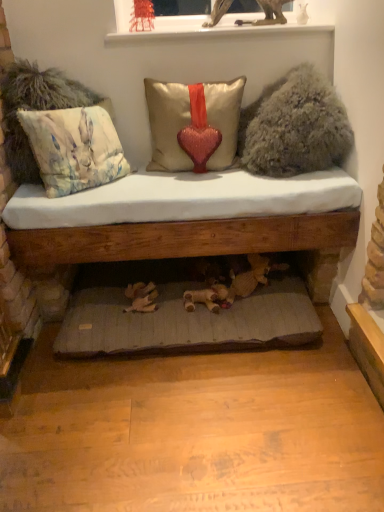
Where is `satin/velvet pillow with heart at center, which is the first pillow in right-to-left order`? The height and width of the screenshot is (512, 384). satin/velvet pillow with heart at center, which is the first pillow in right-to-left order is located at coordinates (193, 124).

This screenshot has height=512, width=384. What do you see at coordinates (193, 124) in the screenshot?
I see `satin/velvet pillow with heart at center, which appears as the second pillow when viewed from the left` at bounding box center [193, 124].

Where is `gray fabric cushion at lower center`? gray fabric cushion at lower center is located at coordinates (195, 432).

Measure the distance between pastel floral fabric cushion at left, arranged as the 1th pillow when viewed from the left, and camera.

They are 5.20 feet apart.

The width and height of the screenshot is (384, 512). Describe the element at coordinates (198, 242) in the screenshot. I see `wooden cushioned bench at center` at that location.

Find the location of a particular element. The image size is (384, 512). fuzzy beige pillow at upper right is located at coordinates (295, 126).

What do you see at coordinates (295, 126) in the screenshot? I see `fuzzy beige pillow at upper right` at bounding box center [295, 126].

The image size is (384, 512). In order to click on satin/velvet pillow with heart at center, which appears as the second pillow when viewed from the left in this screenshot , I will do `click(193, 124)`.

Are wooden bed frame at lower center and fuzzy beige pillow at upper right located far from each other?

No, there isn't a large distance between wooden bed frame at lower center and fuzzy beige pillow at upper right.

Is wooden bed frame at lower center at the right side of fuzzy beige pillow at upper right?

Answer: No, wooden bed frame at lower center is not to the right of fuzzy beige pillow at upper right.

From the image's perspective, is wooden bed frame at lower center located above or below fuzzy beige pillow at upper right?

Clearly, from the image's perspective, wooden bed frame at lower center is below fuzzy beige pillow at upper right.

Considering the sizes of objects wooden bed frame at lower center and fuzzy beige pillow at upper right in the image provided, who is taller, wooden bed frame at lower center or fuzzy beige pillow at upper right?

With more height is fuzzy beige pillow at upper right.

Looking at this image, is gray fabric cushion at lower center oriented away from wooden cushioned bench at center?

No, gray fabric cushion at lower center is not facing the opposite direction of wooden cushioned bench at center.

From the image's perspective, would you say gray fabric cushion at lower center is shown under wooden cushioned bench at center?

Yes.

Is gray fabric cushion at lower center to the right of wooden cushioned bench at center from the viewer's perspective?

No, gray fabric cushion at lower center is not to the right of wooden cushioned bench at center.

How different are the orientations of gray fabric cushion at lower center and wooden cushioned bench at center in degrees?

They differ by 90 degrees in their facing directions.

Is pastel floral fabric cushion at left, arranged as the 1th pillow when viewed from the left, at the left side of satin/velvet pillow with heart at center, which appears as the second pillow when viewed from the left?

Correct, you'll find pastel floral fabric cushion at left, arranged as the 1th pillow when viewed from the left, to the left of satin/velvet pillow with heart at center, which appears as the second pillow when viewed from the left.

Is pastel floral fabric cushion at left, arranged as the 1th pillow when viewed from the left, wider or thinner than satin/velvet pillow with heart at center, which is the first pillow in right-to-left order?

In the image, pastel floral fabric cushion at left, arranged as the 1th pillow when viewed from the left, appears to be more narrow than satin/velvet pillow with heart at center, which is the first pillow in right-to-left order.

In the scene shown: Is pastel floral fabric cushion at left, acting as the second pillow starting from the right, beside satin/velvet pillow with heart at center, which is the first pillow in right-to-left order?

There is a gap between pastel floral fabric cushion at left, acting as the second pillow starting from the right, and satin/velvet pillow with heart at center, which is the first pillow in right-to-left order.

Considering the relative sizes of white glossy window sill at upper center and fuzzy beige pillow at upper right in the image provided, is white glossy window sill at upper center smaller than fuzzy beige pillow at upper right?

Correct, white glossy window sill at upper center occupies less space than fuzzy beige pillow at upper right.

Which is behind, white glossy window sill at upper center or fuzzy beige pillow at upper right?

white glossy window sill at upper center is behind.

From a real-world perspective, does white glossy window sill at upper center sit lower than fuzzy beige pillow at upper right?

No, from a real-world perspective, white glossy window sill at upper center is not below fuzzy beige pillow at upper right.

Considering the relative sizes of white glossy window sill at upper center and fuzzy beige pillow at upper right in the image provided, is white glossy window sill at upper center taller than fuzzy beige pillow at upper right?

No.

Considering the sizes of fuzzy beige pillow at upper right and wooden cushioned bench at center in the image, is fuzzy beige pillow at upper right taller or shorter than wooden cushioned bench at center?

In the image, fuzzy beige pillow at upper right appears to be shorter than wooden cushioned bench at center.

Locate an element on the screen. Image resolution: width=384 pixels, height=512 pixels. studio couch behind the fuzzy beige pillow at upper right is located at coordinates (198, 242).

How different are the orientations of gray fabric cushion at lower center and white glossy window sill at upper center in degrees?

There is a 90-degree angle between the facing directions of gray fabric cushion at lower center and white glossy window sill at upper center.

Does gray fabric cushion at lower center have a lesser width compared to white glossy window sill at upper center?

Incorrect, the width of gray fabric cushion at lower center is not less than that of white glossy window sill at upper center.

From a real-world perspective, is gray fabric cushion at lower center above or below white glossy window sill at upper center?

gray fabric cushion at lower center is below white glossy window sill at upper center.

Is there a large distance between gray fabric cushion at lower center and white glossy window sill at upper center?

gray fabric cushion at lower center is positioned a significant distance from white glossy window sill at upper center.

How many degrees apart are the facing directions of fuzzy beige pillow at upper right and pastel floral fabric cushion at left, acting as the second pillow starting from the right?

The angle between the facing direction of fuzzy beige pillow at upper right and the facing direction of pastel floral fabric cushion at left, acting as the second pillow starting from the right, is 44.8 degrees.

Is fuzzy beige pillow at upper right located outside pastel floral fabric cushion at left, arranged as the 1th pillow when viewed from the left?

Indeed, fuzzy beige pillow at upper right is completely outside pastel floral fabric cushion at left, arranged as the 1th pillow when viewed from the left.

Is fuzzy beige pillow at upper right beside pastel floral fabric cushion at left, arranged as the 1th pillow when viewed from the left?

No, fuzzy beige pillow at upper right is not beside pastel floral fabric cushion at left, arranged as the 1th pillow when viewed from the left.

Which is closer to the camera, (260, 112) or (117, 150)?

The point (117, 150) is closer to the camera.

What are the coordinates of `bed frame below the fuzzy beige pillow at upper right (from the image's perspective)` in the screenshot? It's located at (180, 313).

Image resolution: width=384 pixels, height=512 pixels. In order to click on platform located in front of the wooden cushioned bench at center in this screenshot , I will do `click(195, 432)`.

Estimate the real-world distances between objects in this image. Which object is further from white glossy window sill at upper center, pastel floral fabric cushion at left, arranged as the 1th pillow when viewed from the left, or satin/velvet pillow with heart at center, which appears as the second pillow when viewed from the left?

Based on the image, pastel floral fabric cushion at left, arranged as the 1th pillow when viewed from the left, appears to be further to white glossy window sill at upper center.

Estimate the real-world distances between objects in this image. Which object is closer to pastel floral fabric cushion at left, acting as the second pillow starting from the right, gray fabric cushion at lower center or white glossy window sill at upper center?

The object closer to pastel floral fabric cushion at left, acting as the second pillow starting from the right, is white glossy window sill at upper center.

Based on their spatial positions, is pastel floral fabric cushion at left, acting as the second pillow starting from the right, or white glossy window sill at upper center closer to gray fabric cushion at lower center?

Based on the image, pastel floral fabric cushion at left, acting as the second pillow starting from the right, appears to be nearer to gray fabric cushion at lower center.

Based on their spatial positions, is pastel floral fabric cushion at left, acting as the second pillow starting from the right, or wooden cushioned bench at center further from fuzzy beige pillow at upper right?

Based on the image, pastel floral fabric cushion at left, acting as the second pillow starting from the right, appears to be further to fuzzy beige pillow at upper right.

Estimate the real-world distances between objects in this image. Which object is further from wooden bed frame at lower center, gray fabric cushion at lower center or satin/velvet pillow with heart at center, which is the first pillow in right-to-left order?

The object further to wooden bed frame at lower center is satin/velvet pillow with heart at center, which is the first pillow in right-to-left order.

Based on their spatial positions, is pastel floral fabric cushion at left, acting as the second pillow starting from the right, or gray fabric cushion at lower center closer to white glossy window sill at upper center?

pastel floral fabric cushion at left, acting as the second pillow starting from the right, is closer to white glossy window sill at upper center.

When comparing their distances from satin/velvet pillow with heart at center, which is the first pillow in right-to-left order, does pastel floral fabric cushion at left, acting as the second pillow starting from the right, or gray fabric cushion at lower center seem closer?

Based on the image, pastel floral fabric cushion at left, acting as the second pillow starting from the right, appears to be nearer to satin/velvet pillow with heart at center, which is the first pillow in right-to-left order.

Based on their spatial positions, is pastel floral fabric cushion at left, arranged as the 1th pillow when viewed from the left, or wooden bed frame at lower center closer to satin/velvet pillow with heart at center, which is the first pillow in right-to-left order?

The object closer to satin/velvet pillow with heart at center, which is the first pillow in right-to-left order, is pastel floral fabric cushion at left, arranged as the 1th pillow when viewed from the left.

This screenshot has height=512, width=384. Identify the location of studio couch between white glossy window sill at upper center and wooden bed frame at lower center vertically. (198, 242).

Locate an element on the screen. The width and height of the screenshot is (384, 512). studio couch between satin/velvet pillow with heart at center, which is the first pillow in right-to-left order, and gray fabric cushion at lower center from top to bottom is located at coordinates (198, 242).

The image size is (384, 512). What are the coordinates of `animal between white glossy window sill at upper center and satin/velvet pillow with heart at center, which is the first pillow in right-to-left order, from top to bottom` in the screenshot? It's located at (295, 126).

Identify the location of bed frame between white glossy window sill at upper center and gray fabric cushion at lower center from top to bottom. (180, 313).